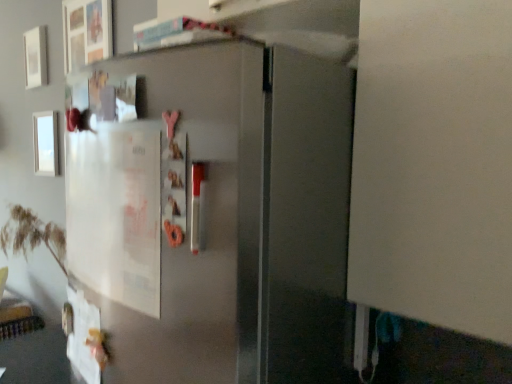
Question: Is white matte picture frame at upper left, positioned as the second picture frame in bottom-to-top order, oriented away from white glossy picture frame at upper left, the first picture frame from the bottom?

Choices:
 (A) yes
 (B) no

Answer: (B)

Question: From the image's perspective, is white matte picture frame at upper left, positioned as the second picture frame in bottom-to-top order, above white glossy picture frame at upper left, which appears as the second picture frame when viewed from the top?

Choices:
 (A) no
 (B) yes

Answer: (B)

Question: Is white glossy picture frame at upper left, the first picture frame from the bottom, inside white matte picture frame at upper left, positioned as the second picture frame in bottom-to-top order?

Choices:
 (A) no
 (B) yes

Answer: (A)

Question: Is white matte picture frame at upper left, positioned as the second picture frame in bottom-to-top order, in front of white glossy picture frame at upper left, which appears as the second picture frame when viewed from the top?

Choices:
 (A) no
 (B) yes

Answer: (A)

Question: Considering the relative sizes of white matte picture frame at upper left, which appears as the 1th picture frame when viewed from the top, and white glossy picture frame at upper left, which appears as the second picture frame when viewed from the top, in the image provided, is white matte picture frame at upper left, which appears as the 1th picture frame when viewed from the top, bigger than white glossy picture frame at upper left, which appears as the second picture frame when viewed from the top,?

Choices:
 (A) no
 (B) yes

Answer: (B)

Question: Is white matte picture frame at upper left, which appears as the 1th picture frame when viewed from the top, taller than white glossy picture frame at upper left, which appears as the second picture frame when viewed from the top?

Choices:
 (A) no
 (B) yes

Answer: (A)

Question: Considering the relative positions of white glossy picture frame at upper left, which appears as the second picture frame when viewed from the top, and white matte picture frame at upper left, positioned as the second picture frame in bottom-to-top order, in the image provided, is white glossy picture frame at upper left, which appears as the second picture frame when viewed from the top, behind white matte picture frame at upper left, positioned as the second picture frame in bottom-to-top order,?

Choices:
 (A) no
 (B) yes

Answer: (A)

Question: Would you say white glossy picture frame at upper left, which appears as the second picture frame when viewed from the top, is outside white matte picture frame at upper left, positioned as the second picture frame in bottom-to-top order?

Choices:
 (A) no
 (B) yes

Answer: (B)

Question: Considering the relative sizes of white glossy picture frame at upper left, the first picture frame from the bottom, and white matte picture frame at upper left, which appears as the 1th picture frame when viewed from the top, in the image provided, is white glossy picture frame at upper left, the first picture frame from the bottom, wider than white matte picture frame at upper left, which appears as the 1th picture frame when viewed from the top,?

Choices:
 (A) yes
 (B) no

Answer: (B)

Question: Is white glossy picture frame at upper left, which appears as the second picture frame when viewed from the top, aimed at white matte picture frame at upper left, positioned as the second picture frame in bottom-to-top order?

Choices:
 (A) yes
 (B) no

Answer: (B)

Question: Can you confirm if white glossy picture frame at upper left, which appears as the second picture frame when viewed from the top, is thinner than white matte picture frame at upper left, which appears as the 1th picture frame when viewed from the top?

Choices:
 (A) yes
 (B) no

Answer: (A)

Question: Does white glossy picture frame at upper left, the first picture frame from the bottom, appear on the right side of white matte picture frame at upper left, which appears as the 1th picture frame when viewed from the top?

Choices:
 (A) yes
 (B) no

Answer: (A)

Question: Choose the correct answer: Is white glossy picture frame at upper left, which appears as the second picture frame when viewed from the top, inside white matte picture frame at upper left, positioned as the second picture frame in bottom-to-top order, or outside it?

Choices:
 (A) outside
 (B) inside

Answer: (A)